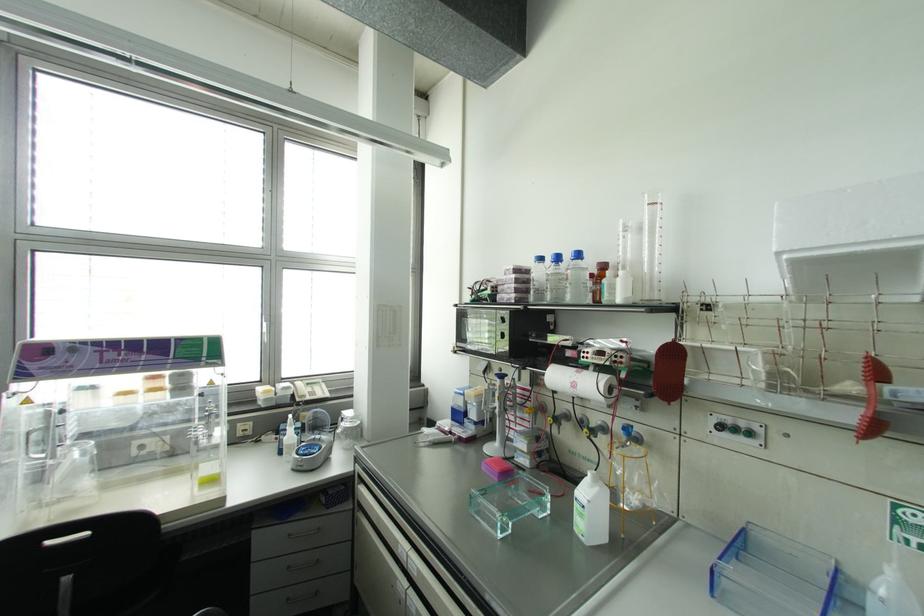
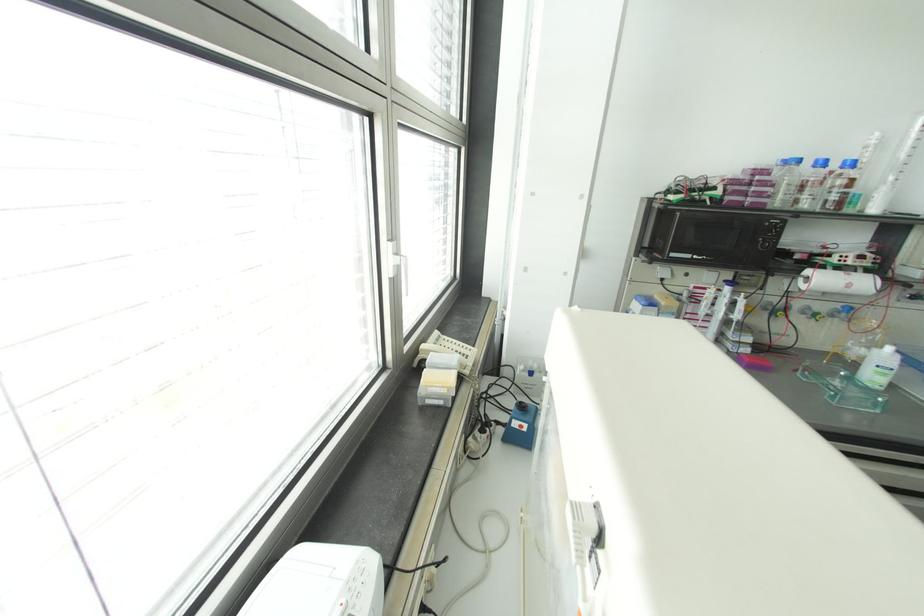
The point at (496, 410) is marked in the first image. Where is the corresponding point in the second image?

(736, 315)